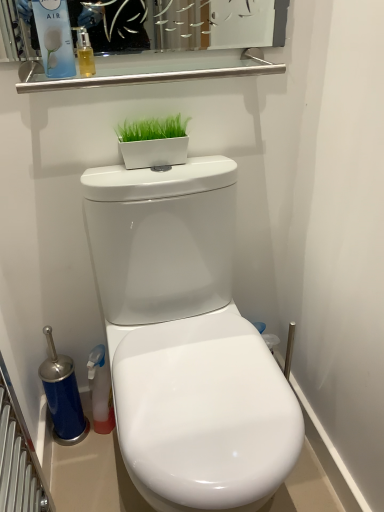
Identify the location of free spot below satin nickel bar at upper center (from a real-world perspective). (162, 170).